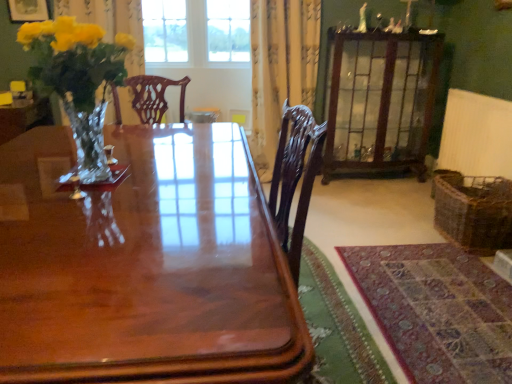
This screenshot has height=384, width=512. What do you see at coordinates (196, 32) in the screenshot?
I see `clear glass window at upper center` at bounding box center [196, 32].

What is the approximate height of wooden glass cabinet at upper right?

It is 1.23 meters.

Describe the element at coordinates (281, 68) in the screenshot. The image size is (512, 384). I see `yellow floral-patterned curtain at upper center` at that location.

Locate an element on the screen. This screenshot has width=512, height=384. matte gold picture frame at upper left is located at coordinates (28, 10).

What is the approximate width of white textured radiator at right?

10.87 centimeters.

Identify the location of clear glass window at upper center. The image size is (512, 384). (196, 32).

From the image's perspective, which object appears higher, rug with intricate patterns at lower right or clear glass window at upper center?

From the image's view, clear glass window at upper center is above.

Between rug with intricate patterns at lower right and clear glass window at upper center, which one has smaller size?

rug with intricate patterns at lower right.

Which object is thinner, rug with intricate patterns at lower right or clear glass window at upper center?

With smaller width is clear glass window at upper center.

Which object is more forward, rug with intricate patterns at lower right or glossy wood table at center?

glossy wood table at center.

Does point (369, 288) lie in front of point (88, 314)?

That is False.

Is glossy wood table at center a part of rug with intricate patterns at lower right?

Definitely not — glossy wood table at center is not inside rug with intricate patterns at lower right.

Is rug with intricate patterns at lower right shorter than glossy wood table at center?

Correct, rug with intricate patterns at lower right is not as tall as glossy wood table at center.

Who is more distant, glossy wood table at center or yellow floral-patterned curtain at upper center?

yellow floral-patterned curtain at upper center is further from the camera.

Does glossy wood table at center turn towards yellow floral-patterned curtain at upper center?

No, glossy wood table at center is not oriented towards yellow floral-patterned curtain at upper center.

Looking at this image, considering the positions of objects glossy wood table at center and yellow floral-patterned curtain at upper center in the image provided, who is more to the left, glossy wood table at center or yellow floral-patterned curtain at upper center?

From the viewer's perspective, glossy wood table at center appears more on the left side.

Identify the location of radiator lying in front of the matte gold picture frame at upper left. Image resolution: width=512 pixels, height=384 pixels. (476, 135).

Is white textured radiator at right smaller than matte gold picture frame at upper left?

No.

From a real-world perspective, is white textured radiator at right beneath matte gold picture frame at upper left?

Indeed, from a real-world perspective, white textured radiator at right is positioned beneath matte gold picture frame at upper left.

Between white textured radiator at right and matte gold picture frame at upper left, which one has larger width?

white textured radiator at right.

This screenshot has height=384, width=512. Identify the location of floral arrangement on the left of the yellow floral-patterned curtain at upper center. (79, 80).

Is shiny glass vase with yellow flowers at left beside yellow floral-patterned curtain at upper center?

A: No.

Is shiny glass vase with yellow flowers at left surrounding yellow floral-patterned curtain at upper center?

No, shiny glass vase with yellow flowers at left does not contain yellow floral-patterned curtain at upper center.

Is shiny glass vase with yellow flowers at left at the left side of yellow floral-patterned curtain at upper center?

Yes.

Is yellow floral-patterned curtain at upper center beside white textured radiator at right?

There is a gap between yellow floral-patterned curtain at upper center and white textured radiator at right.

Between yellow floral-patterned curtain at upper center and white textured radiator at right, which one has smaller size?

white textured radiator at right is smaller.

From the image's perspective, which one is positioned lower, yellow floral-patterned curtain at upper center or white textured radiator at right?

white textured radiator at right.

Does point (310, 57) appear closer or farther from the camera than point (483, 118)?

Point (310, 57) is positioned farther from the camera compared to point (483, 118).

You are a GUI agent. You are given a task and a screenshot of the screen. Output one action in this format:
    pyautogui.click(x=<x>, y=<y>)
    Task: Click on the picture frame lying above the shiny glass vase with yellow flowers at left (from the image's perspective)
    
    Given the screenshot: What is the action you would take?
    pyautogui.click(x=28, y=10)

Who is taller, matte gold picture frame at upper left or shiny glass vase with yellow flowers at left?

shiny glass vase with yellow flowers at left.

From the image's perspective, which is above, matte gold picture frame at upper left or shiny glass vase with yellow flowers at left?

matte gold picture frame at upper left.

Which is in front, matte gold picture frame at upper left or shiny glass vase with yellow flowers at left?

shiny glass vase with yellow flowers at left is closer to the camera.

Where is `window above the rug with intricate patterns at lower right (from a real-world perspective)`? window above the rug with intricate patterns at lower right (from a real-world perspective) is located at coordinates (196, 32).

Locate an element on the screen. Image resolution: width=512 pixels, height=384 pixels. mat below the glossy wood table at center (from the image's perspective) is located at coordinates (437, 311).

Based on their spatial positions, is rug with intricate patterns at lower right or white textured radiator at right closer to clear glass window at upper center?

Based on the image, white textured radiator at right appears to be nearer to clear glass window at upper center.

Considering their positions, is wooden glass cabinet at upper right positioned further to clear glass window at upper center than rug with intricate patterns at lower right?

Based on the image, rug with intricate patterns at lower right appears to be further to clear glass window at upper center.

Based on their spatial positions, is clear glass window at upper center or wooden glass cabinet at upper right further from woven brown basket at lower right?

clear glass window at upper center is further to woven brown basket at lower right.

When comparing their distances from matte gold picture frame at upper left, does wooden glass cabinet at upper right or white textured radiator at right seem closer?

The object closer to matte gold picture frame at upper left is wooden glass cabinet at upper right.

Estimate the real-world distances between objects in this image. Which object is further from woven brown basket at lower right, clear glass window at upper center or yellow floral-patterned curtain at upper center?

clear glass window at upper center.

Which object lies further to the anchor point wooden glass cabinet at upper right, shiny glass vase with yellow flowers at left or clear glass window at upper center?

shiny glass vase with yellow flowers at left.

When comparing their distances from shiny glass vase with yellow flowers at left, does woven brown basket at lower right or yellow floral-patterned curtain at upper center seem further?

woven brown basket at lower right is further to shiny glass vase with yellow flowers at left.

Which object lies further to the anchor point wooden glass cabinet at upper right, white textured radiator at right or woven brown basket at lower right?

woven brown basket at lower right is positioned further to the anchor wooden glass cabinet at upper right.

I want to click on mat between glossy wood table at center and clear glass window at upper center along the z-axis, so click(437, 311).

I want to click on mat between glossy wood table at center and yellow floral-patterned curtain at upper center along the z-axis, so click(x=437, y=311).

Where is `radiator between rug with intricate patterns at lower right and wooden glass cabinet at upper right along the z-axis`? The width and height of the screenshot is (512, 384). radiator between rug with intricate patterns at lower right and wooden glass cabinet at upper right along the z-axis is located at coordinates (476, 135).

This screenshot has height=384, width=512. I want to click on curtain situated between clear glass window at upper center and white textured radiator at right from left to right, so click(281, 68).